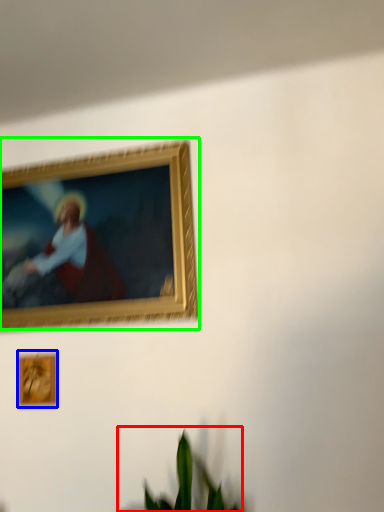
Question: Considering the real-world distances, which object is farthest from houseplant (highlighted by a red box)? picture frame (highlighted by a blue box) or picture frame (highlighted by a green box)?

Choices:
 (A) picture frame
 (B) picture frame

Answer: (B)